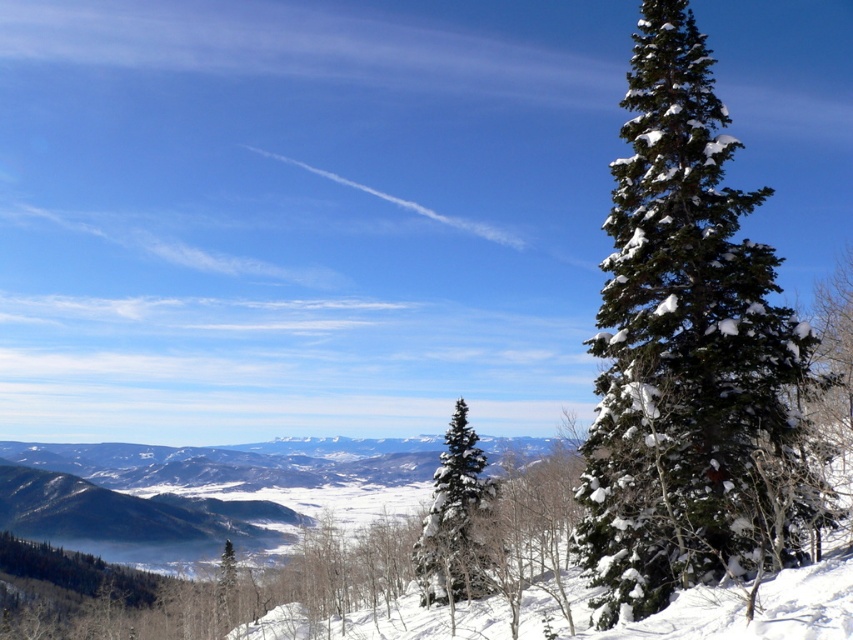
Looking at this image, which is below, green needle-like tree at center or snow-covered evergreen at center?

Positioned lower is snow-covered evergreen at center.

Does green needle-like tree at center appear on the right side of snow-covered evergreen at center?

Yes, green needle-like tree at center is to the right of snow-covered evergreen at center.

Does point (595, 513) come farther from viewer compared to point (456, 532)?

That is False.

Image resolution: width=853 pixels, height=640 pixels. I want to click on green needle-like tree at center, so click(x=688, y=356).